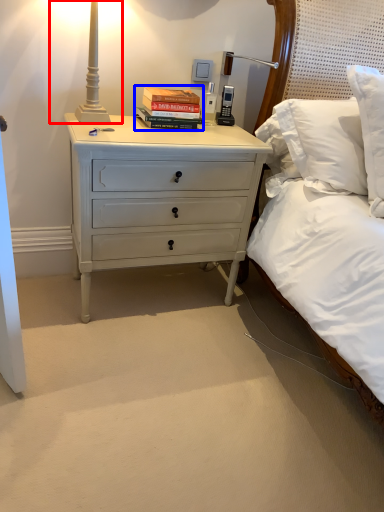
Question: Among these objects, which one is farthest to the camera, bedside lamp (highlighted by a red box) or book (highlighted by a blue box)?

Choices:
 (A) bedside lamp
 (B) book

Answer: (B)